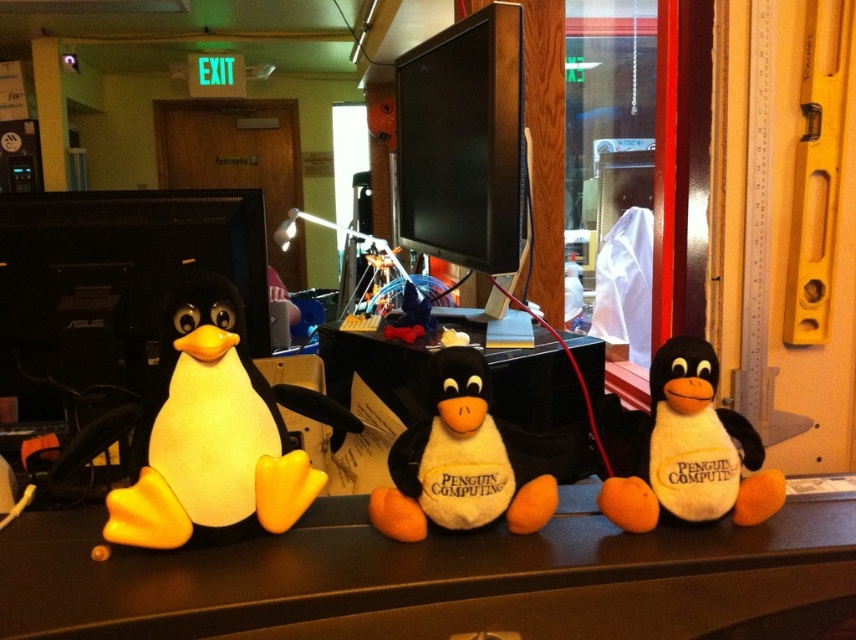
You are organizing a desk and need to place a new item between the white matte table at center and the yellow felt penguin at left. Based on their positions, which object should the new item be closer to?

The white matte table at center is to the right of the yellow felt penguin at left, so the new item should be placed closer to the yellow felt penguin at left to maintain the left to right order.

You are organizing a desk and want to place a 7.5 inch wide book between the white matte table at center and the white plush penguin at center. Can you fit the book between them?

The white matte table at center and white plush penguin at center are 6.80 inches apart. Since the book is 7.5 inches wide, which is wider than the space between them, the book cannot fit between them.